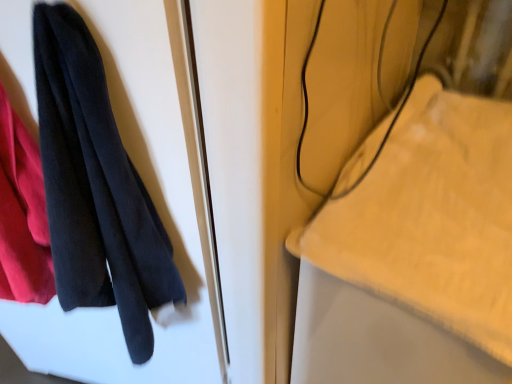
Question: Considering the relative sizes of black cotton towel at left and yellow plush towel at upper right in the image provided, is black cotton towel at left taller than yellow plush towel at upper right?

Choices:
 (A) yes
 (B) no

Answer: (B)

Question: From the image's perspective, is black cotton towel at left located above yellow plush towel at upper right?

Choices:
 (A) no
 (B) yes

Answer: (B)

Question: Is black cotton towel at left bigger than yellow plush towel at upper right?

Choices:
 (A) no
 (B) yes

Answer: (A)

Question: Is black cotton towel at left wider than yellow plush towel at upper right?

Choices:
 (A) yes
 (B) no

Answer: (B)

Question: Is black cotton towel at left to the left of yellow plush towel at upper right from the viewer's perspective?

Choices:
 (A) no
 (B) yes

Answer: (B)

Question: Does black cotton towel at left have a lesser height compared to yellow plush towel at upper right?

Choices:
 (A) yes
 (B) no

Answer: (A)

Question: Does yellow plush towel at upper right come behind black cotton towel at left?

Choices:
 (A) no
 (B) yes

Answer: (B)

Question: Can you confirm if yellow plush towel at upper right is smaller than black cotton towel at left?

Choices:
 (A) yes
 (B) no

Answer: (B)

Question: Can you confirm if yellow plush towel at upper right is wider than black cotton towel at left?

Choices:
 (A) yes
 (B) no

Answer: (A)

Question: From the image's perspective, would you say yellow plush towel at upper right is shown under black cotton towel at left?

Choices:
 (A) yes
 (B) no

Answer: (A)

Question: Is yellow plush towel at upper right positioned beyond the bounds of black cotton towel at left?

Choices:
 (A) no
 (B) yes

Answer: (B)

Question: Is yellow plush towel at upper right placed right next to black cotton towel at left?

Choices:
 (A) yes
 (B) no

Answer: (B)

Question: Looking at their shapes, would you say yellow plush towel at upper right is wider or thinner than black cotton towel at left?

Choices:
 (A) thin
 (B) wide

Answer: (B)